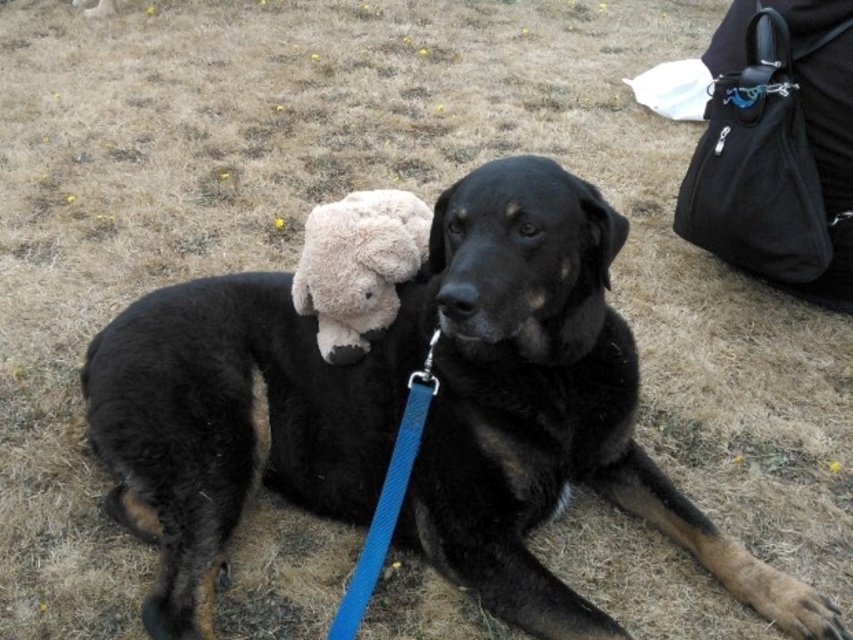
You are a dog owner who wants to buy a new dog bed for your black soft fur dog at center. The store has a bed that is the same size as the fuzzy beige teddy bear at center. Will this bed be big enough for your dog?

The black soft fur dog at center is wider than the fuzzy beige teddy bear at center, so the bed that matches the teddy bear size will not be sufficient for the dog.